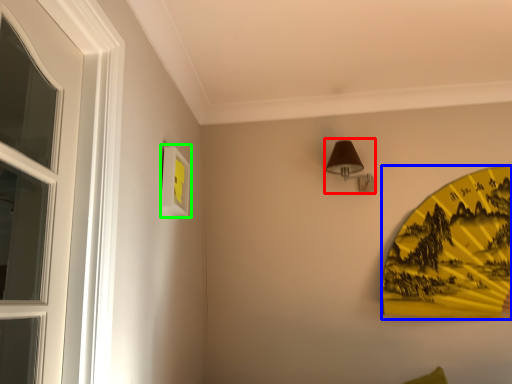
Question: Estimate the real-world distances between objects in this image. Which object is farther from lamp (highlighted by a red box), design (highlighted by a blue box) or picture frame (highlighted by a green box)?

Choices:
 (A) design
 (B) picture frame

Answer: (B)